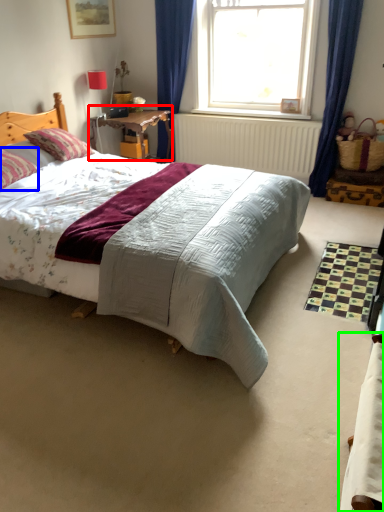
Question: Which object is positioned closest to table (highlighted by a red box)? Select from pillow (highlighted by a blue box) and bed (highlighted by a green box).

Choices:
 (A) pillow
 (B) bed

Answer: (A)